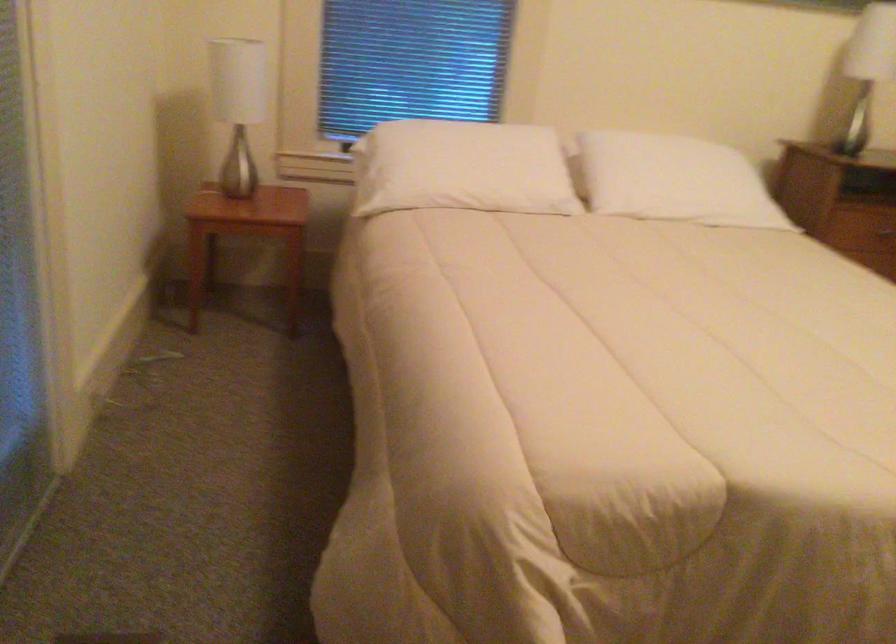
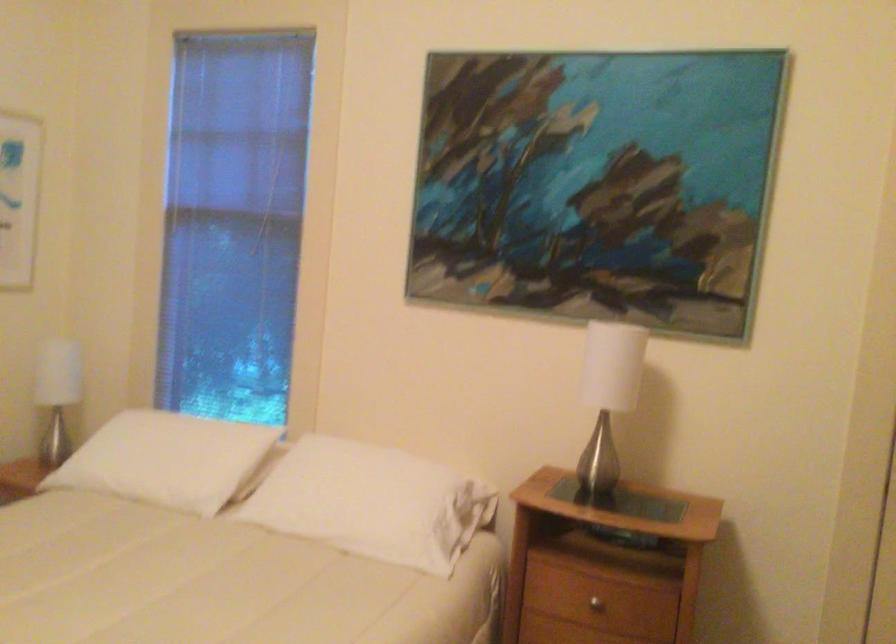
Where in the second image is the point corresponding to pixel 511 162 from the first image?

(167, 459)